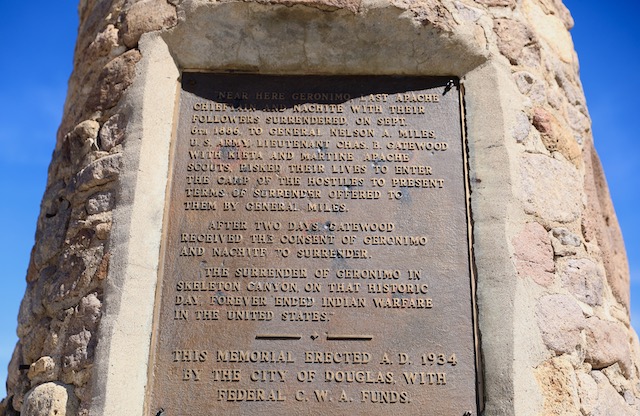
Find the location of `plaque`. plaque is located at coordinates (454, 312).